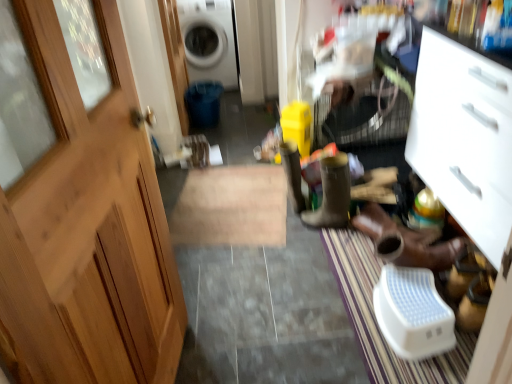
Question: From the image's perspective, is brown leather boot at center, arranged as the 1th footwear when viewed from the left, under yellow rubber boot at center?

Choices:
 (A) yes
 (B) no

Answer: (A)

Question: Could you tell me if brown leather boot at center, which is counted as the second footwear, starting from the right, is facing yellow rubber boot at center?

Choices:
 (A) no
 (B) yes

Answer: (A)

Question: Is brown leather boot at center, arranged as the 1th footwear when viewed from the left, far from yellow rubber boot at center?

Choices:
 (A) no
 (B) yes

Answer: (A)

Question: Does brown leather boot at center, which is counted as the second footwear, starting from the right, lie in front of yellow rubber boot at center?

Choices:
 (A) no
 (B) yes

Answer: (B)

Question: Considering the relative positions of brown leather boot at center, which is counted as the second footwear, starting from the right, and yellow rubber boot at center in the image provided, is brown leather boot at center, which is counted as the second footwear, starting from the right, to the left of yellow rubber boot at center from the viewer's perspective?

Choices:
 (A) no
 (B) yes

Answer: (A)

Question: From a real-world perspective, is brown leather boot at center, which is counted as the second footwear, starting from the right, positioned over yellow rubber boot at center based on gravity?

Choices:
 (A) no
 (B) yes

Answer: (B)

Question: Does yellow rubber boot at center have a larger size compared to brown leather boot at center, which is counted as the second footwear, starting from the right?

Choices:
 (A) no
 (B) yes

Answer: (A)

Question: Is yellow rubber boot at center touching brown leather boot at center, which is counted as the second footwear, starting from the right?

Choices:
 (A) no
 (B) yes

Answer: (A)

Question: Is yellow rubber boot at center oriented towards brown leather boot at center, which is counted as the second footwear, starting from the right?

Choices:
 (A) yes
 (B) no

Answer: (B)

Question: Is yellow rubber boot at center behind brown leather boot at center, arranged as the 1th footwear when viewed from the left?

Choices:
 (A) yes
 (B) no

Answer: (A)

Question: From the image's perspective, is yellow rubber boot at center above brown leather boot at center, arranged as the 1th footwear when viewed from the left?

Choices:
 (A) yes
 (B) no

Answer: (A)

Question: Is yellow rubber boot at center far from brown leather boot at center, arranged as the 1th footwear when viewed from the left?

Choices:
 (A) no
 (B) yes

Answer: (A)

Question: Is brown leather boot at center, which is counted as the second footwear, starting from the right, at the left side of brown leather shoes at lower right, the 2th footwear viewed from the left?

Choices:
 (A) yes
 (B) no

Answer: (A)